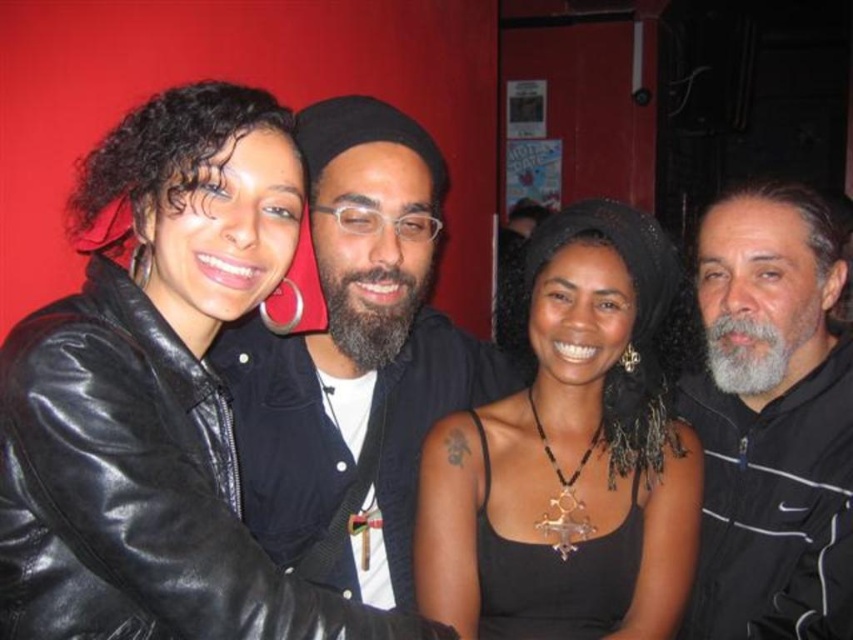
Does black leather jacket at upper left appear under black matte tank top at center?

Incorrect, black leather jacket at upper left is not positioned below black matte tank top at center.

Between point (36, 385) and point (569, 403), which one is positioned behind?

Point (569, 403)

Describe the element at coordinates (157, 397) in the screenshot. I see `black leather jacket at upper left` at that location.

Locate an element on the screen. The height and width of the screenshot is (640, 853). black leather jacket at upper left is located at coordinates (157, 397).

Who is taller, black leather jacket at upper left or gray beard at right?

With more height is gray beard at right.

Between black leather jacket at upper left and gray beard at right, which one appears on the left side from the viewer's perspective?

black leather jacket at upper left

Which is behind, point (172, 240) or point (836, 387)?

The point (836, 387) is more distant.

You are a GUI agent. You are given a task and a screenshot of the screen. Output one action in this format:
    pyautogui.click(x=<x>, y=<y>)
    Task: Click on the black leather jacket at upper left
    
    Given the screenshot: What is the action you would take?
    pyautogui.click(x=157, y=397)

Does black matte tank top at center have a lesser width compared to gray beard at right?

Incorrect, black matte tank top at center's width is not less than gray beard at right's.

In the scene shown: Which is above, black matte tank top at center or gray beard at right?

gray beard at right is above.

Which is in front, point (622, 472) or point (769, 220)?

Point (622, 472) is in front.

The image size is (853, 640). What are the coordinates of `black matte tank top at center` in the screenshot? It's located at (569, 456).